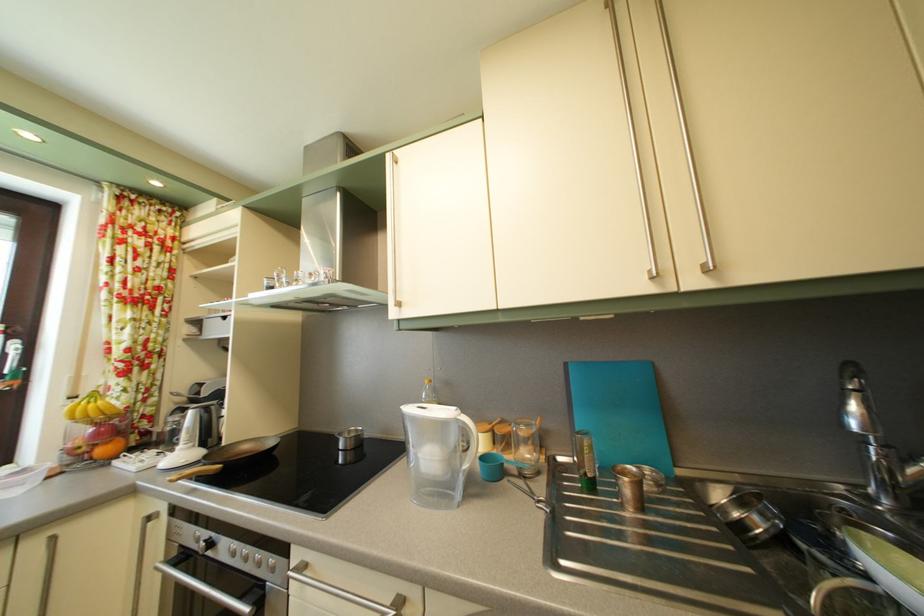
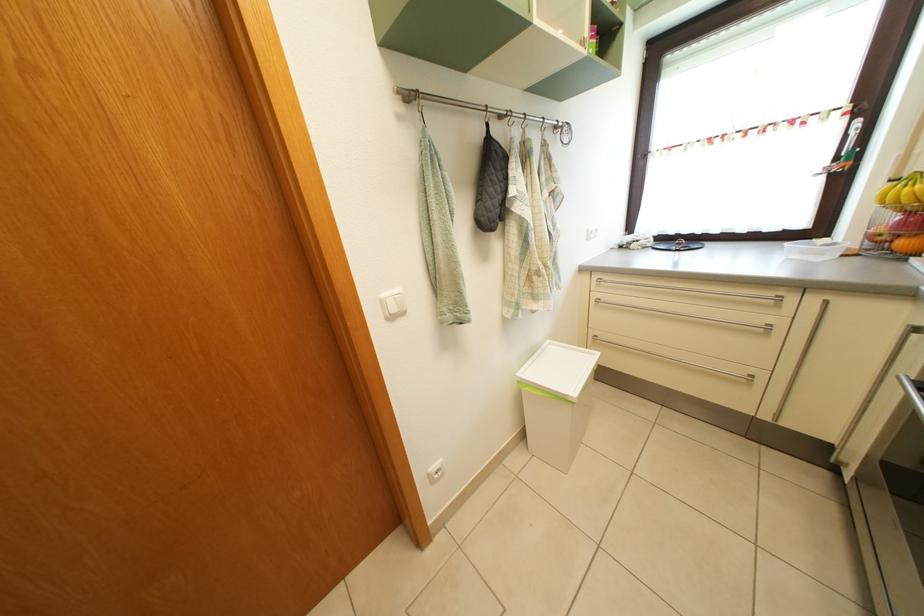
Find the pixel in the second image that matches the point at 111,458 in the first image.

(910, 252)